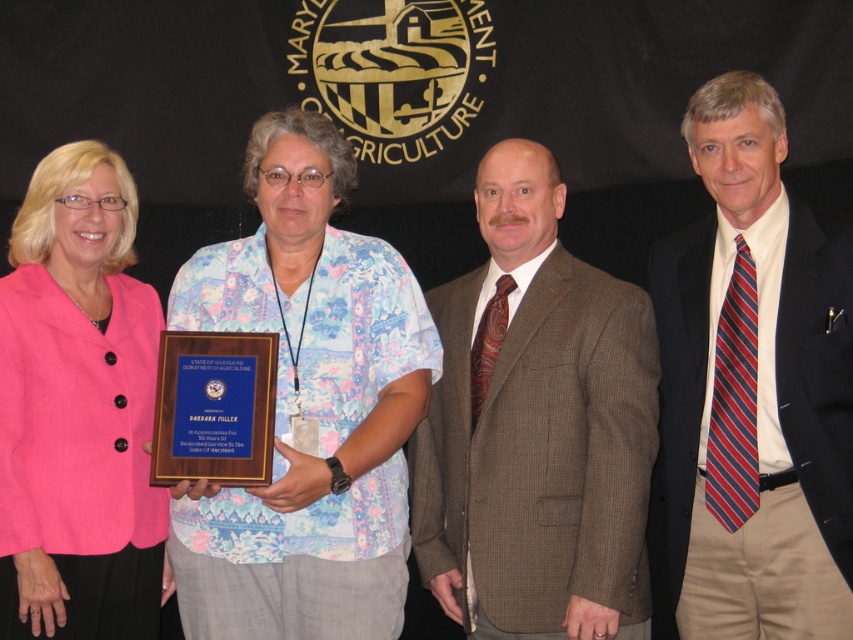
Question: Which point is closer to the camera?

Choices:
 (A) brown textured suit at center
 (B) pink fabric jacket at left
 (C) striped tie at center
 (D) floral fabric shirt at center

Answer: (D)

Question: Can you confirm if striped tie at center is wider than pink fabric jacket at left?

Choices:
 (A) no
 (B) yes

Answer: (A)

Question: Among these points, which one is nearest to the camera?

Choices:
 (A) (761, 566)
 (B) (595, 580)

Answer: (B)

Question: Which object is farther from the camera taking this photo?

Choices:
 (A) floral fabric shirt at center
 (B) striped tie at center
 (C) pink fabric jacket at left
 (D) brown textured suit at center

Answer: (D)

Question: Can you confirm if brown textured suit at center is bigger than striped tie at center?

Choices:
 (A) yes
 (B) no

Answer: (A)

Question: Is floral fabric shirt at center wider than pink fabric jacket at left?

Choices:
 (A) yes
 (B) no

Answer: (A)